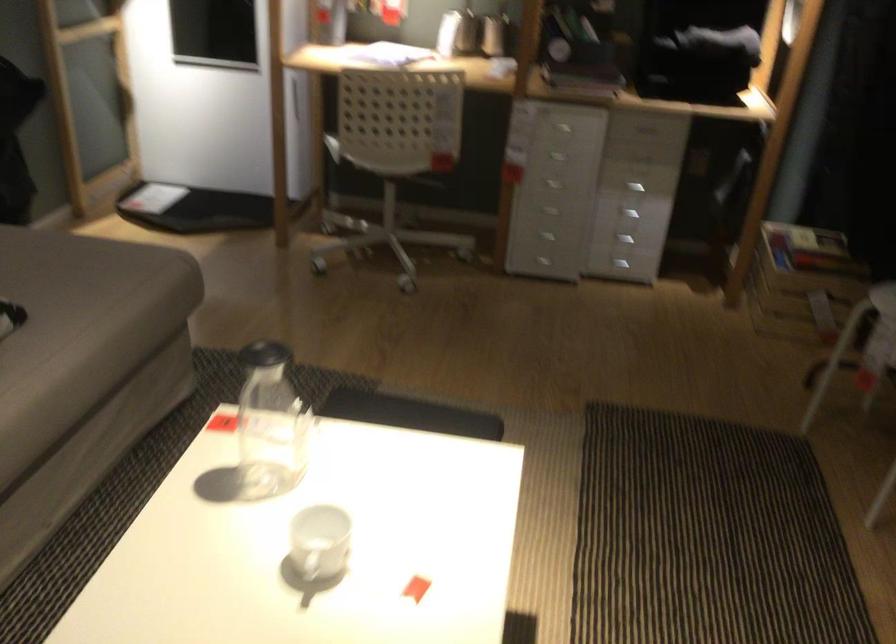
Identify the location of chair sitting surface. (388, 158).